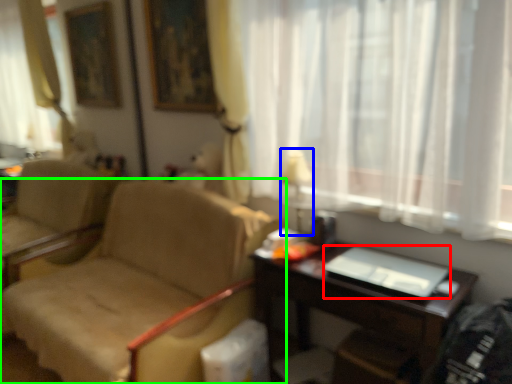
Question: Which is nearer to the laptop (highlighted by a red box)? table lamp (highlighted by a blue box) or chair (highlighted by a green box).

Choices:
 (A) table lamp
 (B) chair

Answer: (A)